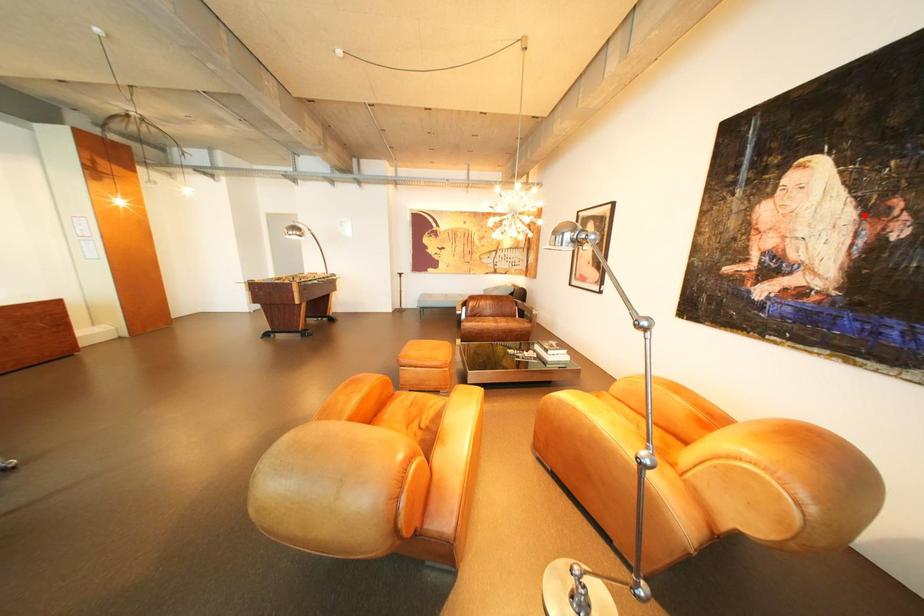
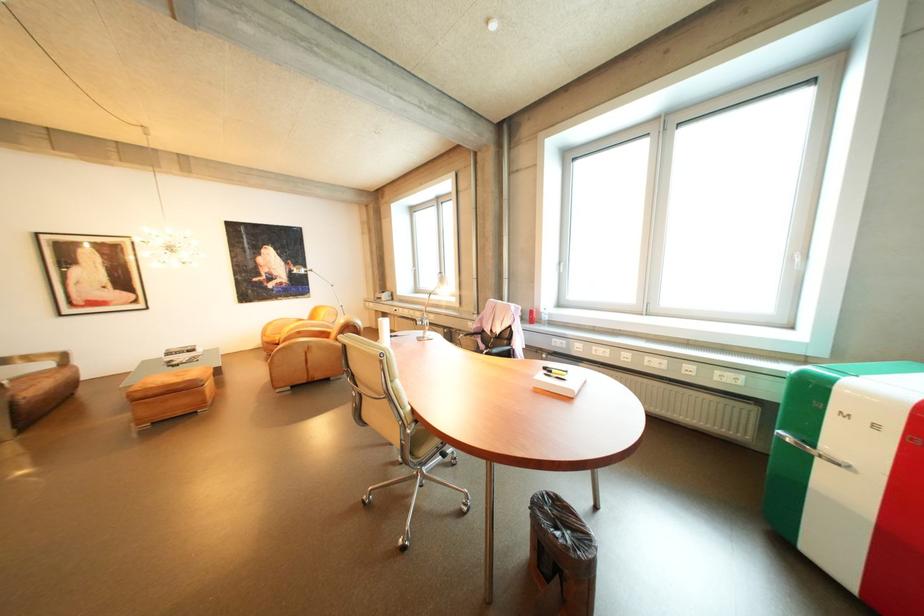
Question: I am providing you with two images of the same scene from different viewpoints. Image1 has a red point marked. In image2, the corresponding 3D location appears at what relative position? Reply with the corresponding letter.

Choices:
 (A) Closer
 (B) Farther

Answer: (A)